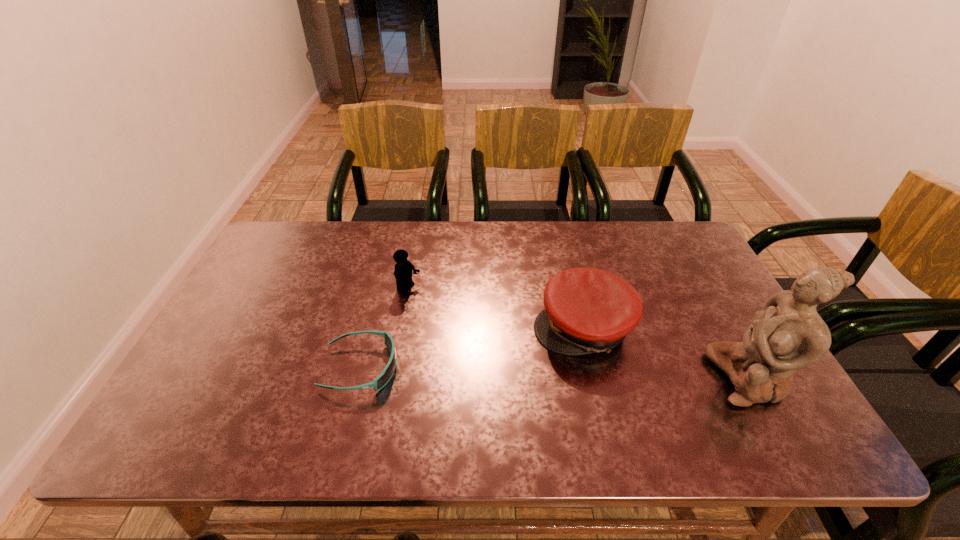
Locate an element on the screen. The width and height of the screenshot is (960, 540). free space located 0.170m on the front-facing side of the Lego is located at coordinates (464, 320).

At what (x,y) coordinates should I click in order to perform the action: click on vacant area situated 0.160m on the front-facing side of the Lego. Please return your answer as a coordinate pair (x, y). Looking at the image, I should click on (461, 318).

The height and width of the screenshot is (540, 960). What are the coordinates of `free space located 0.270m on the front of the cap with an emblem` in the screenshot? It's located at (450, 392).

At what (x,y) coordinates should I click in order to perform the action: click on free spot located 0.200m on the front of the cap with an emblem. Please return your answer as a coordinate pair (x, y). The height and width of the screenshot is (540, 960). Looking at the image, I should click on (476, 380).

You are a GUI agent. You are given a task and a screenshot of the screen. Output one action in this format:
    pyautogui.click(x=<x>, y=<y>)
    Task: Click on the free space located 0.190m on the front of the cap with an emblem
    
    Given the screenshot: What is the action you would take?
    pyautogui.click(x=480, y=377)

Find the location of `sunglasses that is at the near edge`. sunglasses that is at the near edge is located at coordinates (385, 376).

Where is `figurine located in the near edge section of the desktop`? This screenshot has height=540, width=960. figurine located in the near edge section of the desktop is located at coordinates (789, 334).

The image size is (960, 540). I want to click on object situated at the right edge, so click(x=789, y=334).

This screenshot has width=960, height=540. Identify the location of object situated at the near right corner. (789, 334).

Image resolution: width=960 pixels, height=540 pixels. What are the coordinates of `free space at the far edge` in the screenshot? It's located at tap(614, 233).